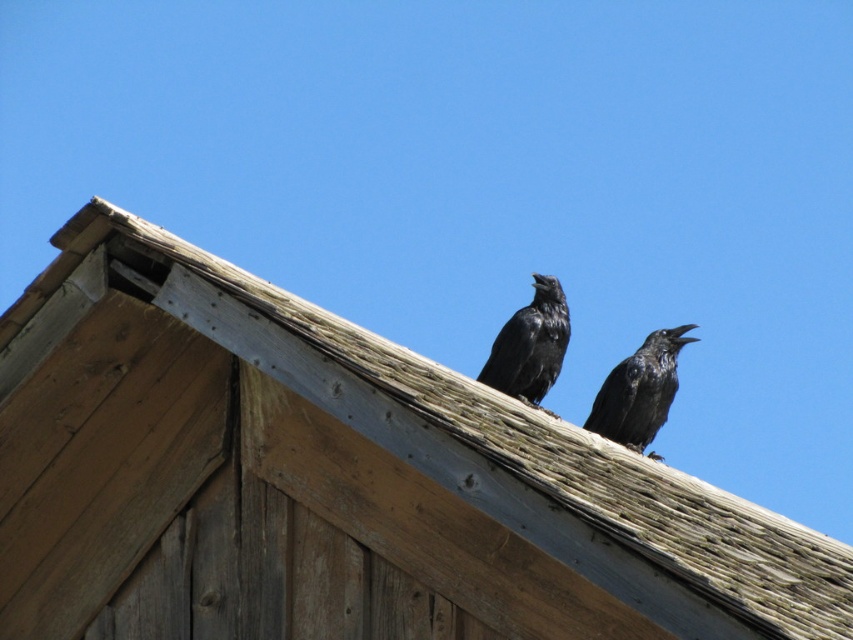
You are a birdwatcher standing 10 meters away from the wooden structure. You want to observe both the wooden shingles at upper center and the shiny black raven at upper right through your telescope. Can you see both objects clearly at the same time with your telescope that has a 15 meter field of view?

The wooden shingles at upper center and the shiny black raven at upper right are 14.77 meters apart from each other. Since your telescope has a 15 meter field of view, you can see both objects clearly at the same time.

You are a birdwatcher observing the scene. You notice the wooden shingles at upper center and the shiny black raven at center. Which object is positioned higher in the image?

The shiny black raven at center is positioned higher than the wooden shingles at upper center because the wooden shingles at upper center is below the shiny black raven at center.

You are a birdwatcher observing the scene. You notice the wooden shingles at upper center and the shiny black raven at center. Which object is positioned to the left of the other?

The wooden shingles at upper center is to the left of the shiny black raven at center according to the description.